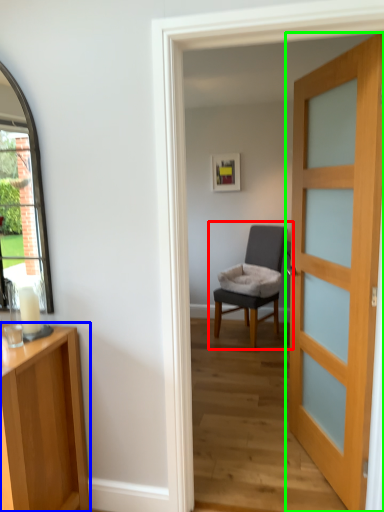
Question: Considering the real-world distances, which object is closest to chair (highlighted by a red box)? cabinetry (highlighted by a blue box) or door (highlighted by a green box).

Choices:
 (A) cabinetry
 (B) door

Answer: (B)